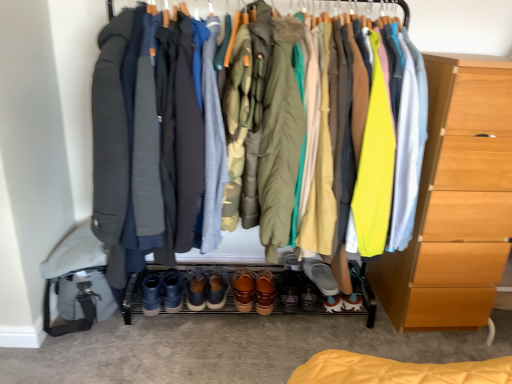
Question: Considering the positions of gray woolen robe at center, the 3th robe positioned from the right, and matte olive green coat at center, marked as the fourth robe in a left-to-right arrangement, in the image, is gray woolen robe at center, the 3th robe positioned from the right, wider or thinner than matte olive green coat at center, marked as the fourth robe in a left-to-right arrangement,?

Choices:
 (A) wide
 (B) thin

Answer: (A)

Question: Visually, is gray woolen robe at center, placed as the second robe when sorted from left to right, positioned to the left or to the right of matte olive green coat at center, the 1th robe when ordered from right to left?

Choices:
 (A) left
 (B) right

Answer: (A)

Question: Estimate the real-world distances between objects in this image. Which object is closer to the camouflage fabric robe at center, which is counted as the 2th robe, starting from the right?

Choices:
 (A) leather shoes at center, the 3th footwear in the right-to-left sequence
 (B) light wood chest of drawers at right
 (C) gray suede shoe at center, the 6th footwear when ordered from left to right
 (D) brown suede shoes at center, the first footwear from the left
 (E) matte black jacket at center

Answer: (E)

Question: Which is farther from the brown suede shoes at center, the fifth footwear in the right-to-left sequence?

Choices:
 (A) gray suede shoe at center, the 6th footwear when ordered from left to right
 (B) leather shoes at center, the 3th footwear in the right-to-left sequence
 (C) gray woolen robe at center, the 3th robe positioned from the right
 (D) matte black jacket at center
 (E) brown suede shoes at center, the sixth footwear positioned from the right

Answer: (D)